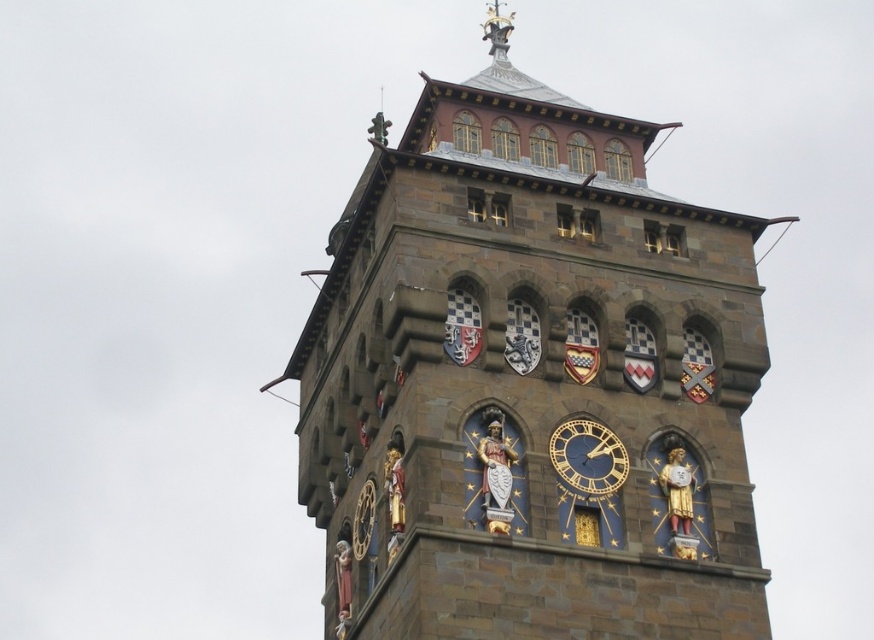
Can you confirm if brown stone clock tower at center is bigger than polished brass statue at upper center?

Indeed, brown stone clock tower at center has a larger size compared to polished brass statue at upper center.

This screenshot has width=874, height=640. Describe the element at coordinates (529, 381) in the screenshot. I see `brown stone clock tower at center` at that location.

Locate an element on the screen. This screenshot has width=874, height=640. brown stone clock tower at center is located at coordinates (529, 381).

Is point (558, 426) behind point (490, 52)?

No, it is in front of (490, 52).

Is gold metallic clock at center behind polished brass statue at upper center?

No, it is not.

Is point (590, 435) more distant than point (511, 20)?

No, it is in front of (511, 20).

Locate an element on the screen. gold metallic clock at center is located at coordinates (588, 458).

Looking at this image, is brown stone clock tower at center positioned before gold metallic clock at center?

Yes, it is in front of gold metallic clock at center.

Is brown stone clock tower at center above gold metallic clock at center?

Yes, brown stone clock tower at center is above gold metallic clock at center.

Where is `brown stone clock tower at center`? This screenshot has height=640, width=874. brown stone clock tower at center is located at coordinates (529, 381).

The height and width of the screenshot is (640, 874). In order to click on brown stone clock tower at center in this screenshot , I will do click(x=529, y=381).